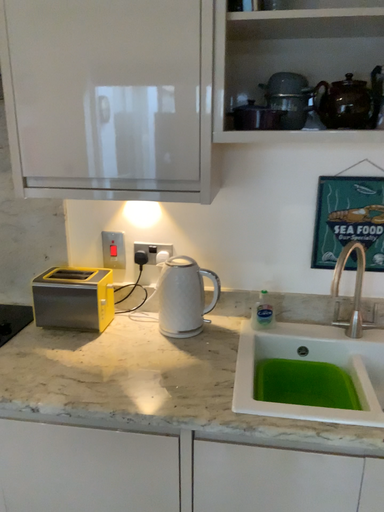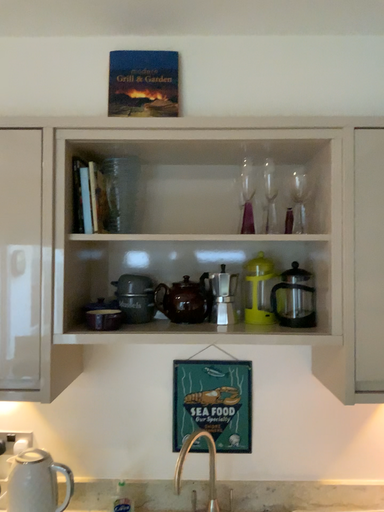
Question: How did the camera likely rotate when shooting the video?

Choices:
 (A) rotated right
 (B) rotated left

Answer: (A)